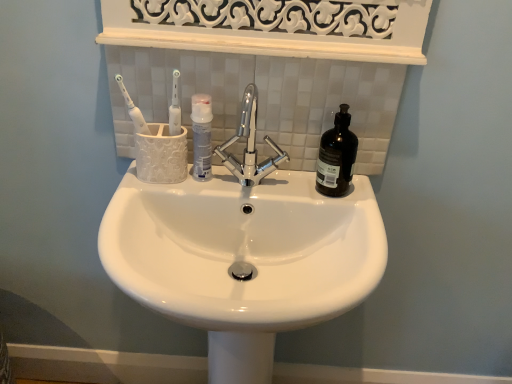
I want to click on free space in front of white matte mouthwash at center, acting as the 2th mouthwash starting from the right, so tap(177, 188).